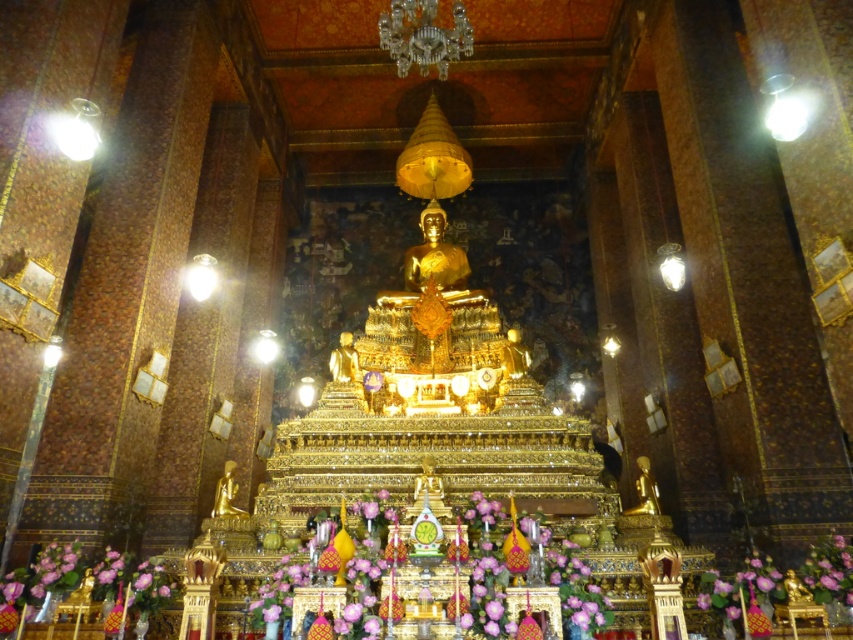
Looking at this image, you are a temple visitor who wants to place a new decoration between the purple silk flowers at center and the purple silk flower at center. Which one should you place the decoration closer to if you want it to be closer to the shorter object?

The purple silk flower at center is shorter than the purple silk flowers at center, so you should place the decoration closer to the purple silk flower at center.

You are a temple visitor who wants to place a small offering at the purple silk flower at center and the gold shiny statue at center. Which object requires more space for the offering?

The gold shiny statue at center requires more space for the offering because it occupies more space than the purple silk flower at center.

You are a temple visitor standing at the entrance and see the purple silk flowers at center and the purple silk flower at center. Which one is closer to you?

The purple silk flowers at center is closer to you because it is in front of the purple silk flower at center.